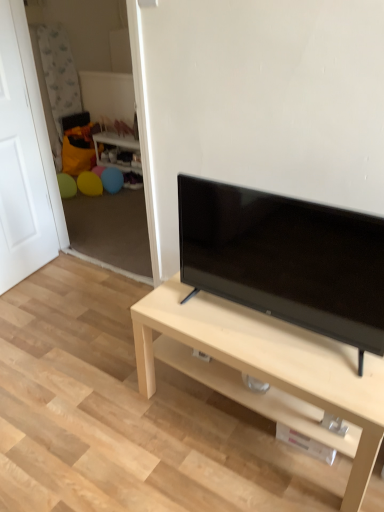
This screenshot has width=384, height=512. I want to click on empty space that is ontop of light wood/finish tv stand at center (from a real-world perspective), so click(x=268, y=332).